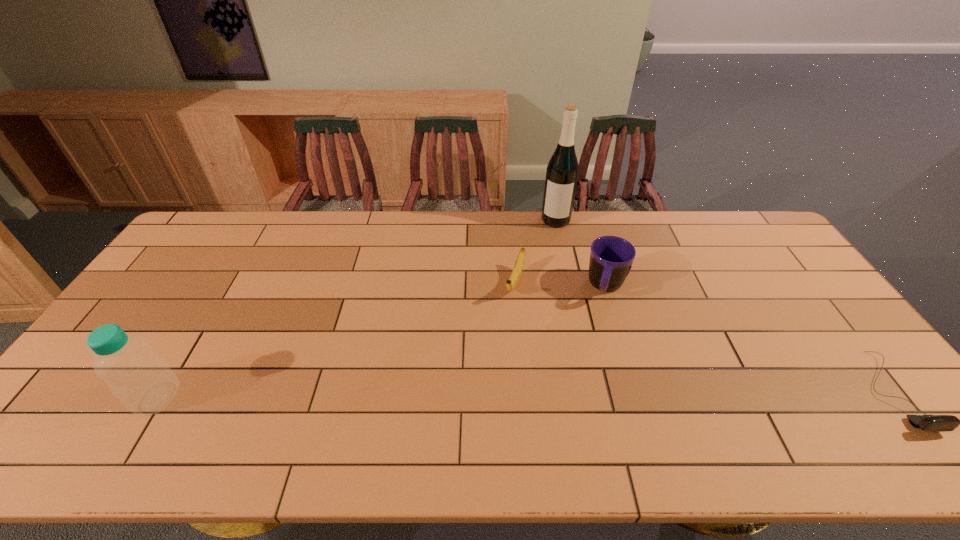
Identify the location of object that is the second nearest to the third tallest object. This screenshot has height=540, width=960. (562, 171).

The image size is (960, 540). I want to click on vacant area in the image that satisfies the following two spatial constraints: 1. on the back side of the wine bottle; 2. on the left side of the bottle, so click(265, 220).